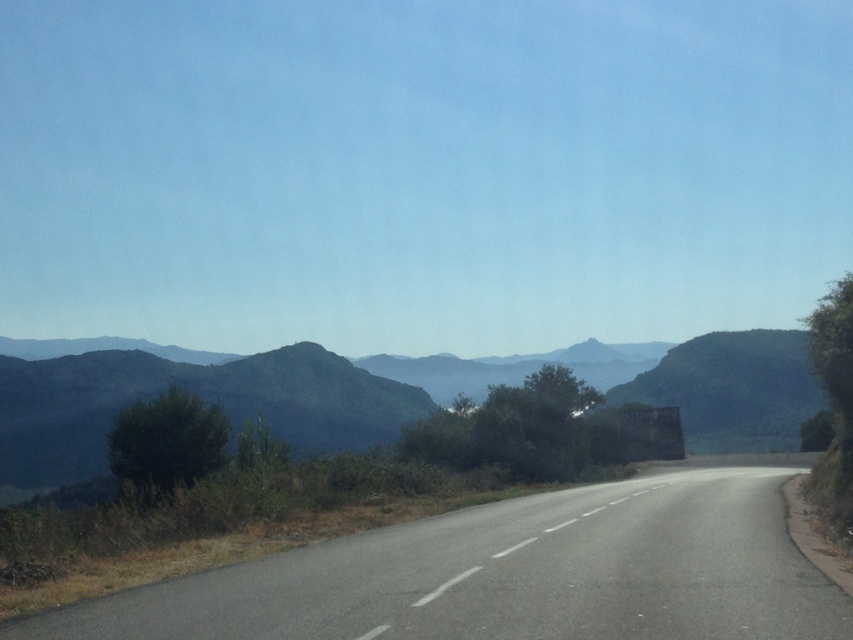
Which of these two, asphalt road at center or green textured mountain at center, stands taller?

green textured mountain at center

Does asphalt road at center have a larger size compared to green textured mountain at center?

Actually, asphalt road at center might be smaller than green textured mountain at center.

Where is `asphalt road at center`? This screenshot has height=640, width=853. asphalt road at center is located at coordinates (511, 576).

Locate an element on the screen. asphalt road at center is located at coordinates (511, 576).